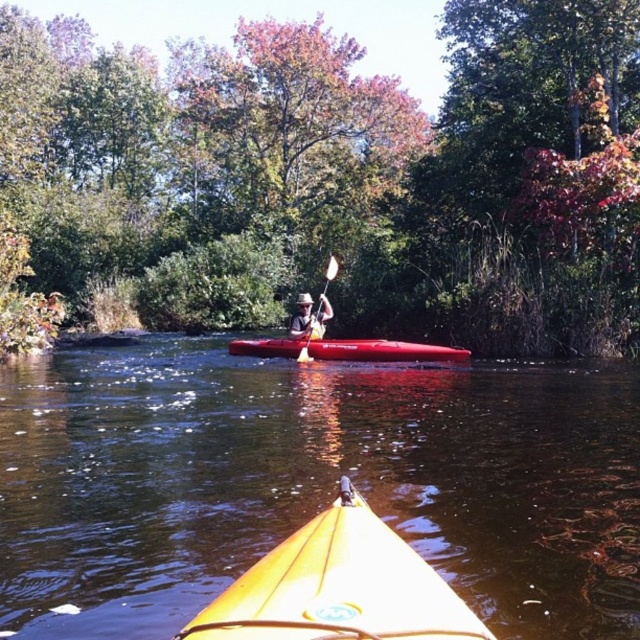
Identify the location of matte brown kayak at center. The height and width of the screenshot is (640, 640). (308, 317).

Does matte brown kayak at center appear on the left side of white wood paddle at center?

Correct, you'll find matte brown kayak at center to the left of white wood paddle at center.

I want to click on matte brown kayak at center, so click(308, 317).

Locate an element on the screen. The width and height of the screenshot is (640, 640). matte brown kayak at center is located at coordinates (308, 317).

Is point (330, 628) positioned before point (300, 353)?

That is True.

Can you confirm if yellow matte kayak at center is positioned below white wood paddle at center?

Yes, yellow matte kayak at center is below white wood paddle at center.

What do you see at coordinates (339, 586) in the screenshot? The height and width of the screenshot is (640, 640). I see `yellow matte kayak at center` at bounding box center [339, 586].

Image resolution: width=640 pixels, height=640 pixels. I want to click on yellow matte kayak at center, so click(x=339, y=586).

Can you confirm if yellow plastic kayak at center is positioned below yellow matte kayak at center?

Yes.

Who is more forward, (284,536) or (410,602)?

Positioned in front is point (410,602).

Which is in front, point (426, 508) or point (465, 604)?

Positioned in front is point (465, 604).

The image size is (640, 640). What are the coordinates of `yellow plastic kayak at center` in the screenshot? It's located at (310, 483).